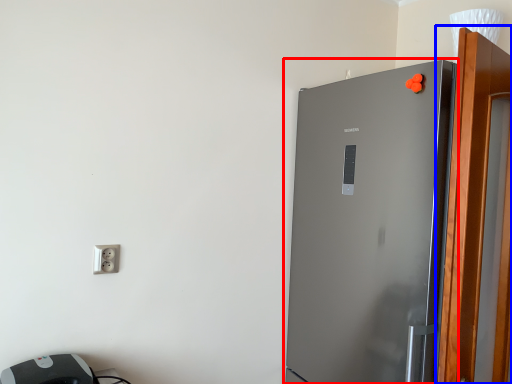
Question: Which point is further to the camera, refrigerator (highlighted by a red box) or screen door (highlighted by a blue box)?

Choices:
 (A) refrigerator
 (B) screen door

Answer: (A)